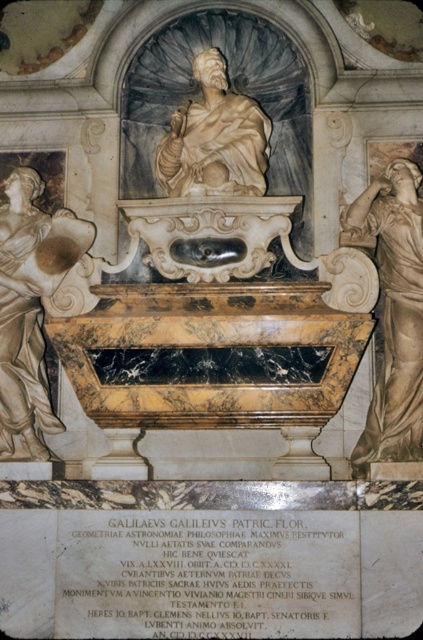
From the picture: Which is more to the right, matte gold statue at right or marble statue at center?

matte gold statue at right

This screenshot has width=423, height=640. What do you see at coordinates (393, 314) in the screenshot?
I see `matte gold statue at right` at bounding box center [393, 314].

Locate an element on the screen. matte gold statue at right is located at coordinates (393, 314).

Where is `matte gold statue at right`? Image resolution: width=423 pixels, height=640 pixels. matte gold statue at right is located at coordinates 393,314.

Is point (16, 179) closer to viewer compared to point (220, 140)?

That is False.

Who is more distant from viewer, (8, 292) or (203, 113)?

The point (203, 113) is more distant.

The image size is (423, 640). In order to click on matte white statue at left in this screenshot , I will do `click(30, 307)`.

Between matte white statue at left and matte gold statue at right, which one appears on the right side from the viewer's perspective?

matte gold statue at right

Is matte white statue at left to the right of matte gold statue at right from the viewer's perspective?

In fact, matte white statue at left is to the left of matte gold statue at right.

At what (x,y) coordinates should I click in order to perform the action: click on matte white statue at left. Please return your answer as a coordinate pair (x, y). Looking at the image, I should click on (30, 307).

I want to click on matte white statue at left, so click(30, 307).